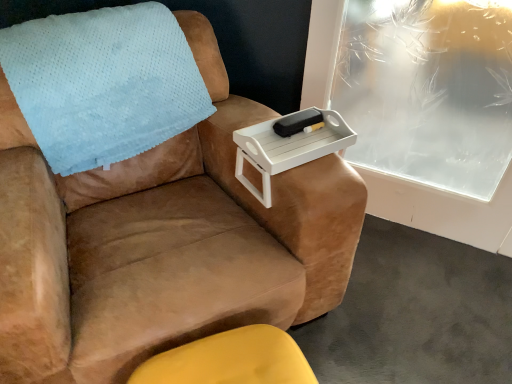
Question: From the image's perspective, is light blue fleece blanket at upper left over black matte tray at upper center?

Choices:
 (A) no
 (B) yes

Answer: (B)

Question: Considering the relative positions of light blue fleece blanket at upper left and black matte tray at upper center in the image provided, is light blue fleece blanket at upper left in front of black matte tray at upper center?

Choices:
 (A) no
 (B) yes

Answer: (B)

Question: From the image's perspective, does light blue fleece blanket at upper left appear lower than black matte tray at upper center?

Choices:
 (A) yes
 (B) no

Answer: (B)

Question: Would you say black matte tray at upper center is part of light blue fleece blanket at upper left's contents?

Choices:
 (A) yes
 (B) no

Answer: (B)

Question: Could you tell me if light blue fleece blanket at upper left is facing black matte tray at upper center?

Choices:
 (A) yes
 (B) no

Answer: (B)

Question: In terms of height, does frosted glass tray at upper right look taller or shorter compared to matte yellow ottoman at lower center?

Choices:
 (A) tall
 (B) short

Answer: (A)

Question: Do you think frosted glass tray at upper right is within matte yellow ottoman at lower center, or outside of it?

Choices:
 (A) inside
 (B) outside

Answer: (B)

Question: In the image, is frosted glass tray at upper right on the left side or the right side of matte yellow ottoman at lower center?

Choices:
 (A) left
 (B) right

Answer: (B)

Question: From the image's perspective, is frosted glass tray at upper right positioned above or below matte yellow ottoman at lower center?

Choices:
 (A) below
 (B) above

Answer: (B)

Question: From the image's perspective, is frosted glass tray at upper right above or below light blue fleece blanket at upper left?

Choices:
 (A) below
 (B) above

Answer: (A)

Question: In the image, is frosted glass tray at upper right positioned in front of or behind light blue fleece blanket at upper left?

Choices:
 (A) front
 (B) behind

Answer: (B)

Question: Is frosted glass tray at upper right bigger or smaller than light blue fleece blanket at upper left?

Choices:
 (A) big
 (B) small

Answer: (A)

Question: Considering the positions of frosted glass tray at upper right and light blue fleece blanket at upper left in the image, is frosted glass tray at upper right taller or shorter than light blue fleece blanket at upper left?

Choices:
 (A) tall
 (B) short

Answer: (A)

Question: Relative to light blue fleece blanket at upper left, is white plastic tray at upper right in front or behind?

Choices:
 (A) behind
 (B) front

Answer: (A)

Question: From a real-world perspective, is white plastic tray at upper right above or below light blue fleece blanket at upper left?

Choices:
 (A) below
 (B) above

Answer: (A)